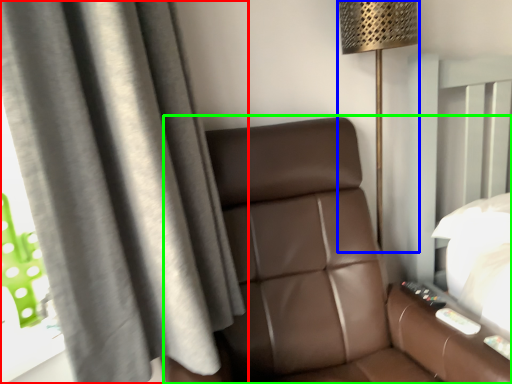
Question: Based on their relative distances, which object is nearer to curtain (highlighted by a red box)? Choose from lamp (highlighted by a blue box) and furniture (highlighted by a green box).

Choices:
 (A) lamp
 (B) furniture

Answer: (B)